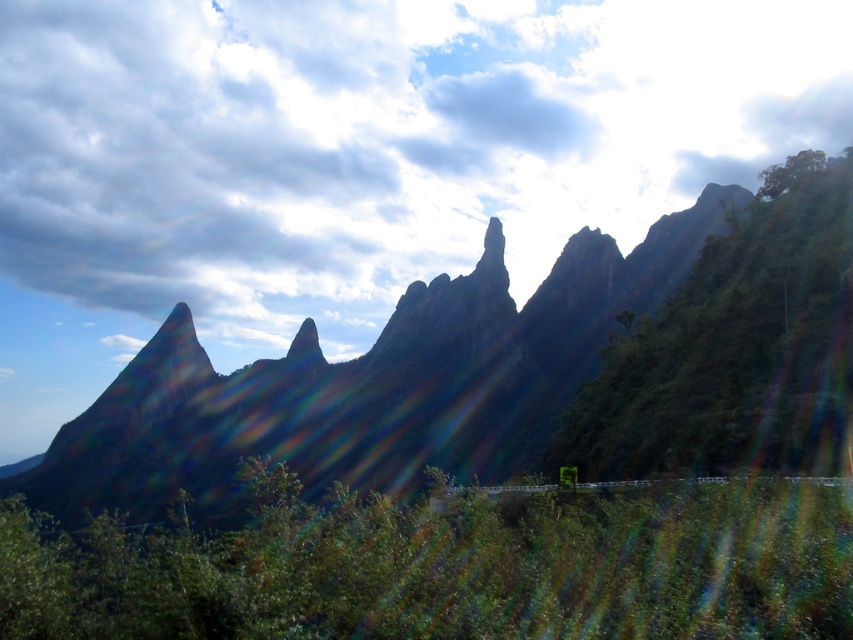
You are a hiker who wants to take a photo of the rugged rock formation at center and the green leafy bush at lower center. If your camera can focus on objects up to 300 feet away, will both subjects be in focus?

The rugged rock formation at center is 285.54 feet away from the green leafy bush at lower center. Since the maximum focusing distance is 300 feet, both subjects will be within the camera range and thus in focus.

You are hiking in the mountains and want to take a photo of both the rugged rock formation at center and the green leafy bush at lower center. Which object should you focus on first to ensure both are in the frame?

You should focus on the rugged rock formation at center first because it is wider than the green leafy bush at lower center, so centering it will help include both in the photo.

You are a photographer trying to capture the rugged rock formation at center and the white fluffy cloud at upper center in the same frame. Based on their relative sizes in the image, which object appears taller?

The white fluffy cloud at upper center appears taller than the rugged rock formation at center in the image.